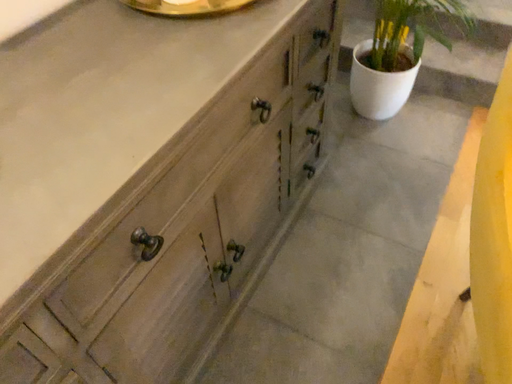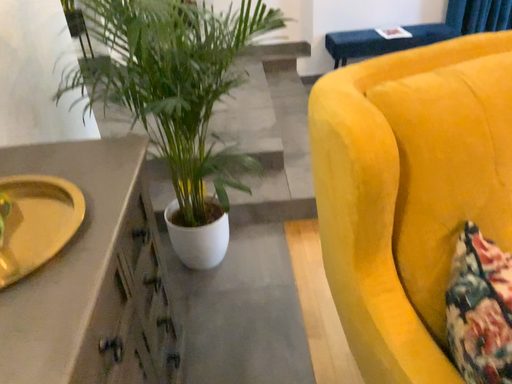
Question: Which way did the camera rotate in the video?

Choices:
 (A) rotated left
 (B) rotated right

Answer: (B)